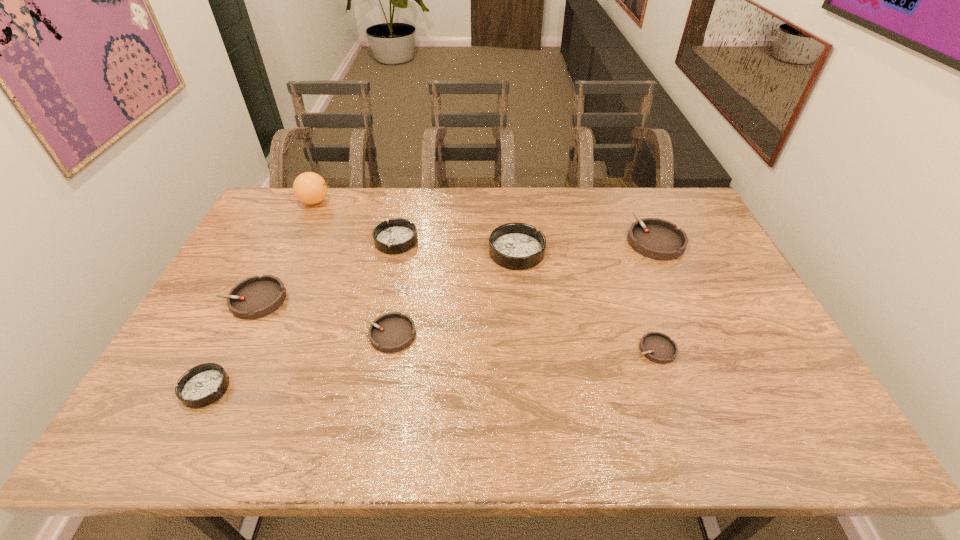
What are the coordinates of `vacant space at the far left corner of the desktop` in the screenshot? It's located at (300, 226).

Identify the location of free space between the leftmost gray ashtray and the farthest object. This screenshot has height=540, width=960. (284, 251).

Locate an element on the screen. The width and height of the screenshot is (960, 540). vacant point located between the third gray ashtray from right to left and the second biggest dark ashtray is located at coordinates (393, 288).

The height and width of the screenshot is (540, 960). Identify the location of free space between the tallest object and the farthest gray ashtray. (485, 221).

I want to click on free space between the nearest object and the third biggest gray ashtray, so click(x=298, y=361).

At what (x,y) coordinates should I click in order to perform the action: click on unoccupied position between the biggest gray ashtray and the tallest object. Please return your answer as a coordinate pair (x, y). This screenshot has width=960, height=540. Looking at the image, I should click on (485, 221).

Locate an element on the screen. free spot between the shortest object and the sixth object from left to right is located at coordinates (587, 301).

Identify the location of vacant region between the second biggest gray ashtray and the shortest ashtray. (455, 325).

Find the location of a particular element. vacant point located between the second smallest gray ashtray and the biggest gray ashtray is located at coordinates (522, 287).

The height and width of the screenshot is (540, 960). In order to click on free space between the second smallest gray ashtray and the smallest gray ashtray in this screenshot , I will do `click(523, 342)`.